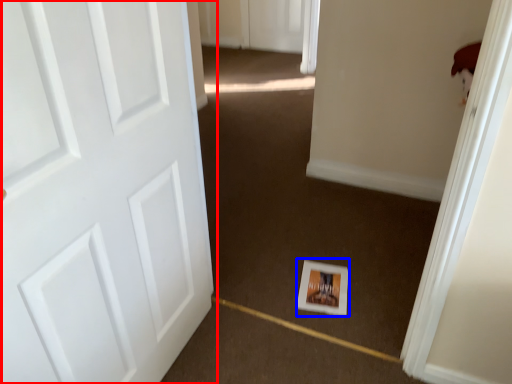
Question: Which of the following is the closest to the observer, door (highlighted by a red box) or postcard (highlighted by a blue box)?

Choices:
 (A) door
 (B) postcard

Answer: (A)